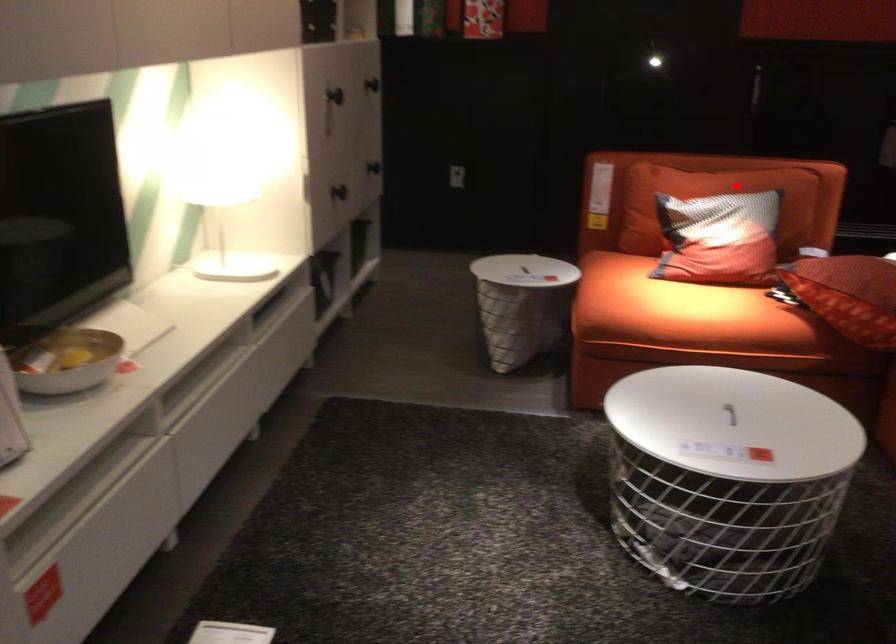
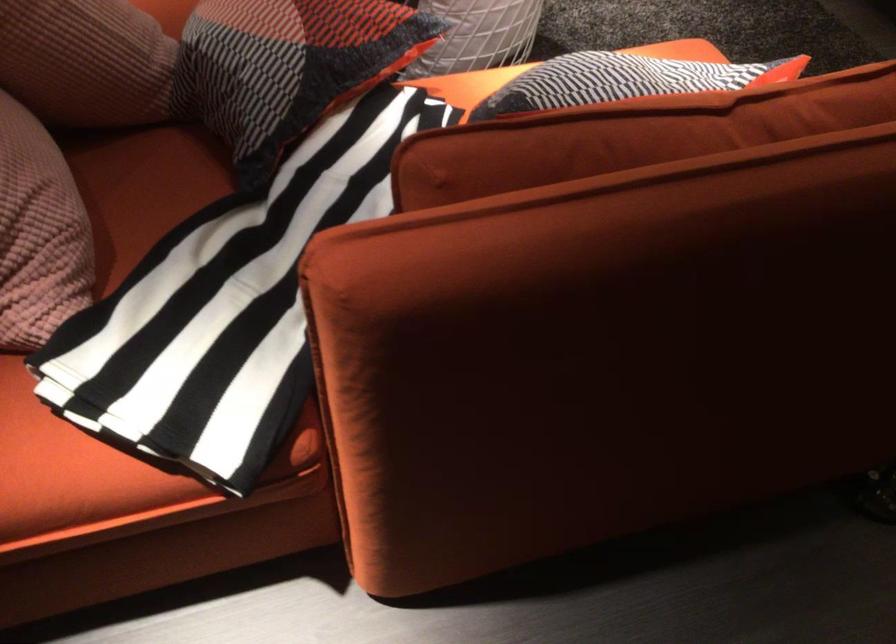
Where in the second image is the point corresponding to the highlighted location from the first image?

(623, 80)